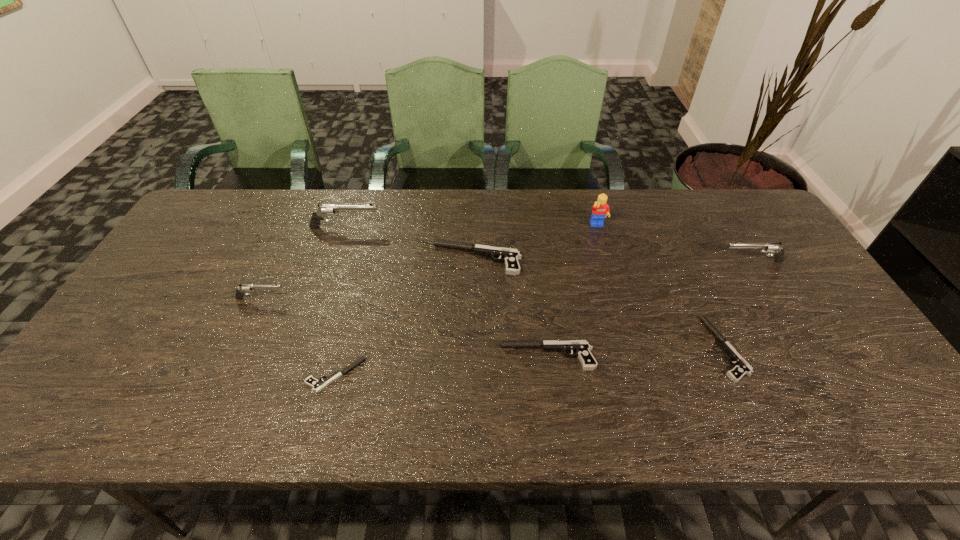
Identify the location of vacant space located 0.240m on the front-facing side of the second pistol from right to left. (613, 349).

This screenshot has height=540, width=960. Identify the location of blank area located 0.080m on the front-facing side of the leftmost black pistol. (274, 375).

Locate an element on the screen. This screenshot has height=540, width=960. vacant area situated on the front-facing side of the leftmost black pistol is located at coordinates (144, 375).

Locate an element on the screen. This screenshot has width=960, height=540. free space located on the front-facing side of the leftmost black pistol is located at coordinates (183, 375).

Where is `Lego at the far edge`? This screenshot has width=960, height=540. Lego at the far edge is located at coordinates (600, 210).

In order to click on pistol present at the far edge in this screenshot , I will do (x=324, y=210).

You are a GUI agent. You are given a task and a screenshot of the screen. Output one action in this format:
    pyautogui.click(x=<x>, y=<y>)
    Task: Click on the object that is at the right edge
    This screenshot has width=960, height=540.
    Given the screenshot: What is the action you would take?
    pyautogui.click(x=774, y=248)

Identify the location of vacant space at the far edge. This screenshot has width=960, height=540. (546, 190).

You are a GUI agent. You are given a task and a screenshot of the screen. Output one action in this format:
    pyautogui.click(x=<x>, y=<y>)
    Task: Click on the vacant region at the near edge of the desktop
    
    Given the screenshot: What is the action you would take?
    pyautogui.click(x=604, y=410)

In the image, there is a desktop. Where is `vacant space at the right edge`? The image size is (960, 540). vacant space at the right edge is located at coordinates (843, 391).